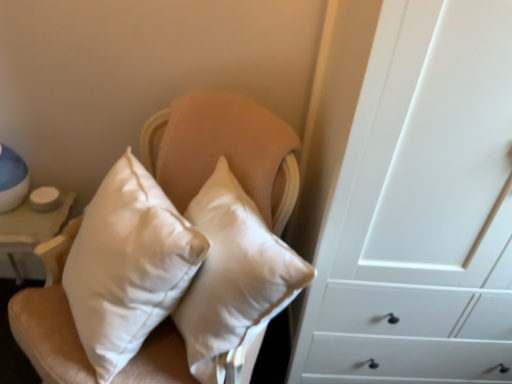
Identify the location of white satin pillows at upper left. This screenshot has height=384, width=512. click(x=222, y=149).

This screenshot has width=512, height=384. What do you see at coordinates (222, 149) in the screenshot? I see `white satin pillows at upper left` at bounding box center [222, 149].

Locate an element on the screen. The width and height of the screenshot is (512, 384). white satin pillows at upper left is located at coordinates (222, 149).